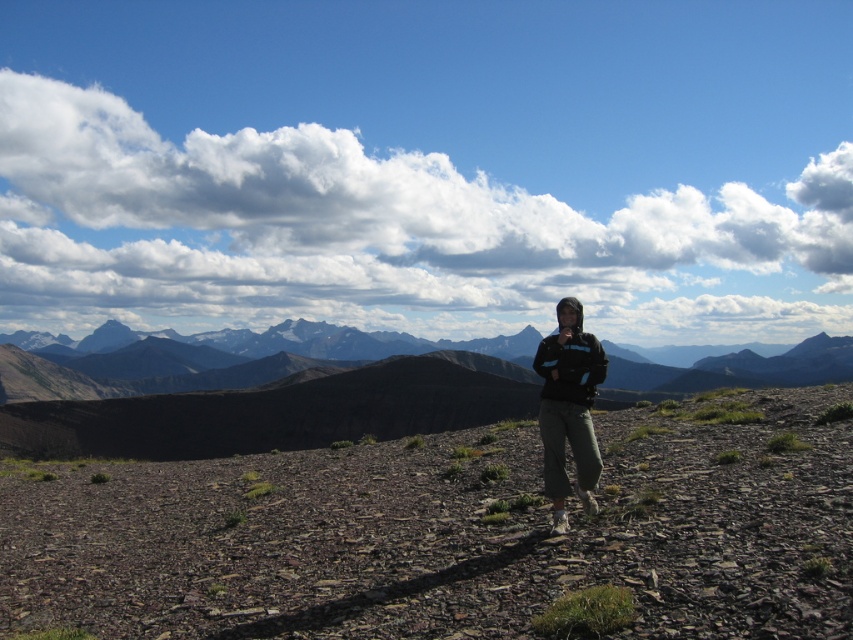
Can you confirm if dull brown dirt at center is shorter than black fabric jacket at center?

Incorrect, dull brown dirt at center's height does not fall short of black fabric jacket at center's.

Can you confirm if dull brown dirt at center is bigger than black fabric jacket at center?

Correct, dull brown dirt at center is larger in size than black fabric jacket at center.

Does point (769, 508) lie behind point (555, 524)?

That is True.

Locate an element on the screen. The height and width of the screenshot is (640, 853). dull brown dirt at center is located at coordinates (445, 534).